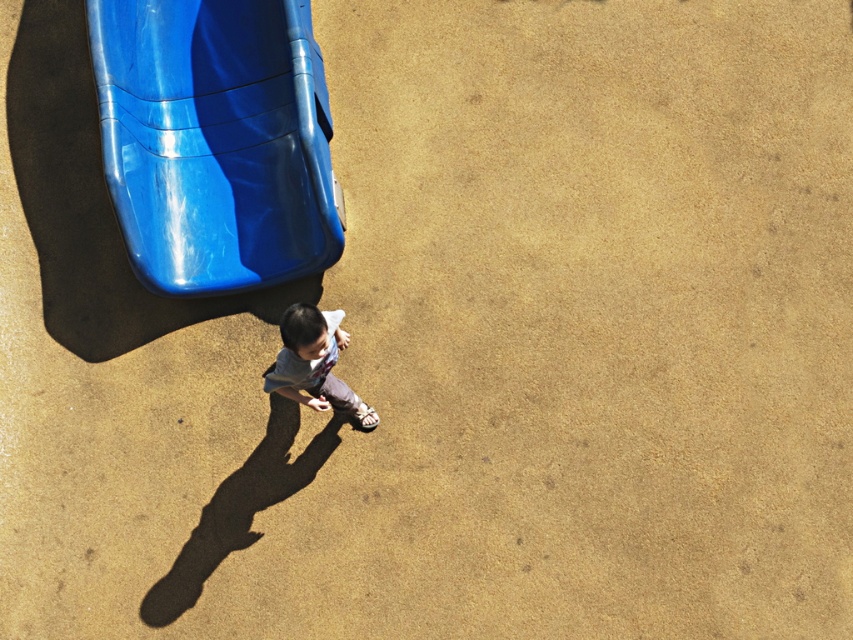
You are a photographer trying to capture the child in the image. To ensure the glossy plastic slide at upper left and the light gray cotton shirt at center are both visible in the frame, which direction should you position your camera relative to the child?

You should position your camera above the child because the glossy plastic slide at upper left is above the light gray cotton shirt at center, so angling the camera from above will include both objects in the frame.

You are a photographer planning to capture the child in the light gray cotton shirt at center and the glossy plastic slide at upper left. You want to ensure both are fully visible in the frame. Which object requires more horizontal space in the photo to avoid being cut off?

The glossy plastic slide at upper left requires more horizontal space in the photo to avoid being cut off because its width surpasses that of the light gray cotton shirt at center.